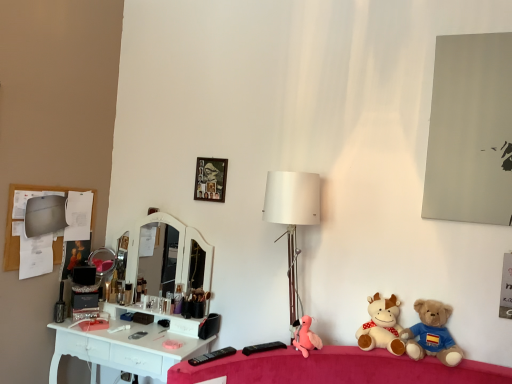
Question: From a real-world perspective, is soft plush cow at lower right, acting as the second toy starting from the left, positioned above or below matte gray mirror at upper right?

Choices:
 (A) below
 (B) above

Answer: (A)

Question: Is soft plush cow at lower right, acting as the second toy starting from the left, inside or outside of matte gray mirror at upper right?

Choices:
 (A) inside
 (B) outside

Answer: (B)

Question: Which is farther from the wooden photo frame at upper center?

Choices:
 (A) white matte table lamp at center
 (B) matte gray mirror at upper right
 (C) soft plush cow at lower right, acting as the second toy starting from the left
 (D) brown plush bear at lower right, which is the 3th toy in left-to-right order
 (E) matte black makeup brush at left

Answer: (D)

Question: Based on their relative distances, which object is nearer to the white matte table lamp at center?

Choices:
 (A) wooden photo frame at upper center
 (B) pink plush at center, acting as the first toy starting from the left
 (C) matte gray mirror at upper right
 (D) soft plush cow at lower right, acting as the second toy starting from the right
 (E) matte black makeup brush at left

Answer: (B)